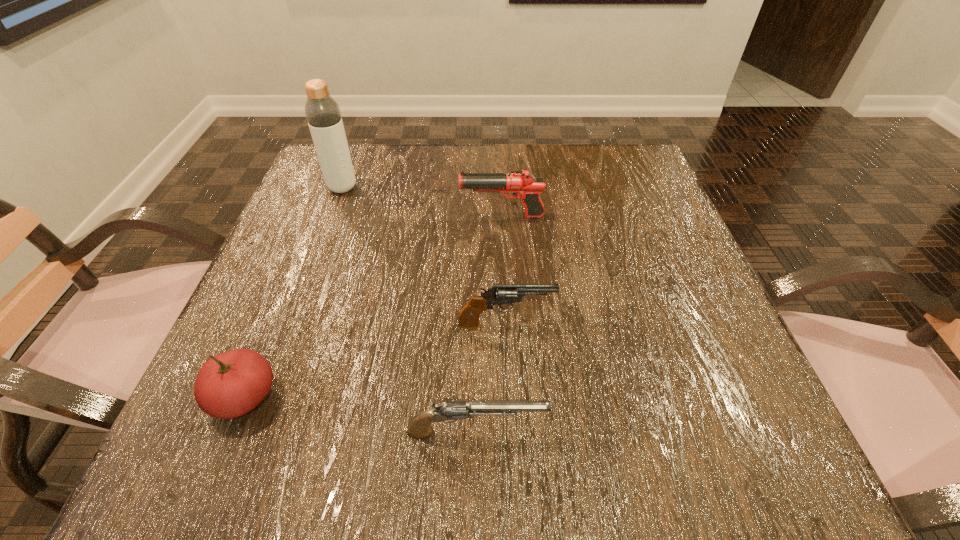
Identify the location of the farthest object. (323, 115).

The width and height of the screenshot is (960, 540). In order to click on the tallest object in this screenshot , I will do `click(323, 115)`.

Find the location of a particular element. the farthest gun is located at coordinates (523, 184).

Find the location of `the third farthest object`. the third farthest object is located at coordinates (469, 316).

This screenshot has height=540, width=960. I want to click on tomato, so click(231, 384).

Find the location of `the shortest object`. the shortest object is located at coordinates (448, 411).

The height and width of the screenshot is (540, 960). Identify the location of the shortest gun. (448, 411).

I want to click on vacant point located 0.300m on the front of the bottle, so click(300, 299).

The image size is (960, 540). In order to click on blank area located at the aiming end of the farthest gun in this screenshot , I will do `click(317, 216)`.

Identify the location of vacant area situated 0.060m at the aiming end of the farthest gun. (431, 216).